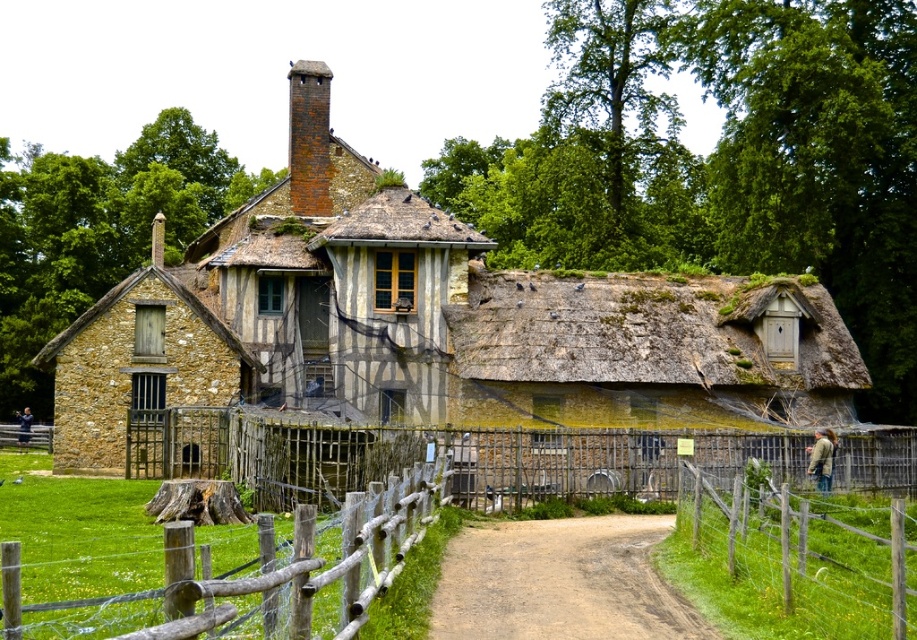
Does point (483, 474) come in front of point (253, 614)?

No, (483, 474) is behind (253, 614).

Between wooden fence at center and wooden rustic fence at center, which one has more height?

wooden rustic fence at center

What do you see at coordinates (437, 456) in the screenshot? I see `wooden fence at center` at bounding box center [437, 456].

The width and height of the screenshot is (917, 640). Identify the location of wooden fence at center. (437, 456).

Does wooden fence at center appear on the left side of rusty brick chimney at upper center?

In fact, wooden fence at center is to the right of rusty brick chimney at upper center.

The height and width of the screenshot is (640, 917). I want to click on wooden fence at center, so click(437, 456).

Does wooden rustic fence at center come in front of rusty brick chimney at upper center?

Yes, wooden rustic fence at center is in front of rusty brick chimney at upper center.

Identify the location of wooden rustic fence at center. This screenshot has height=640, width=917. (200, 577).